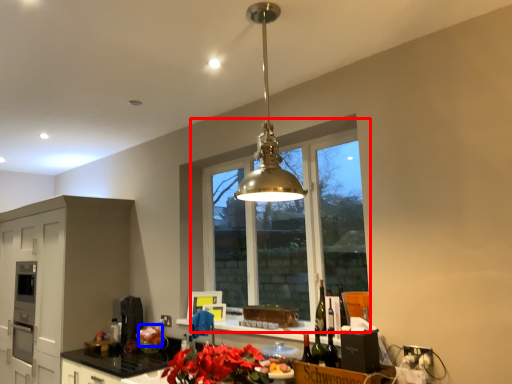
Question: Which of the following is the farthest to the observer, window (highlighted by a red box) or flower (highlighted by a blue box)?

Choices:
 (A) window
 (B) flower

Answer: (B)